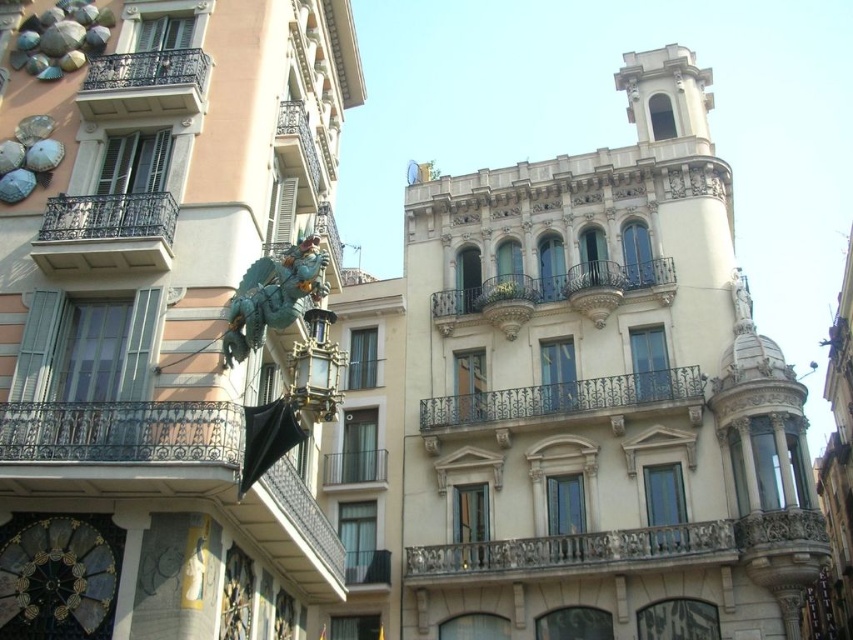
Question: Considering the relative positions of carved stone balcony at center and metallic wrought iron balcony at upper center in the image provided, where is carved stone balcony at center located with respect to metallic wrought iron balcony at upper center?

Choices:
 (A) right
 (B) left

Answer: (A)

Question: Is dark blue wrought iron balcony at center bigger than black wrought iron balcony at upper left?

Choices:
 (A) no
 (B) yes

Answer: (B)

Question: Which point is farther to the camera?

Choices:
 (A) black wrought iron balcony at upper left
 (B) metallic wrought iron balcony at upper center

Answer: (B)

Question: Which point appears farthest from the camera in this image?

Choices:
 (A) (366, 458)
 (B) (146, 52)

Answer: (A)

Question: Among these points, which one is farthest from the camera?

Choices:
 (A) (477, 547)
 (B) (100, 268)

Answer: (A)

Question: Can you confirm if metallic wrought iron balcony at upper center is thinner than metallic silver balcony at center?

Choices:
 (A) no
 (B) yes

Answer: (A)